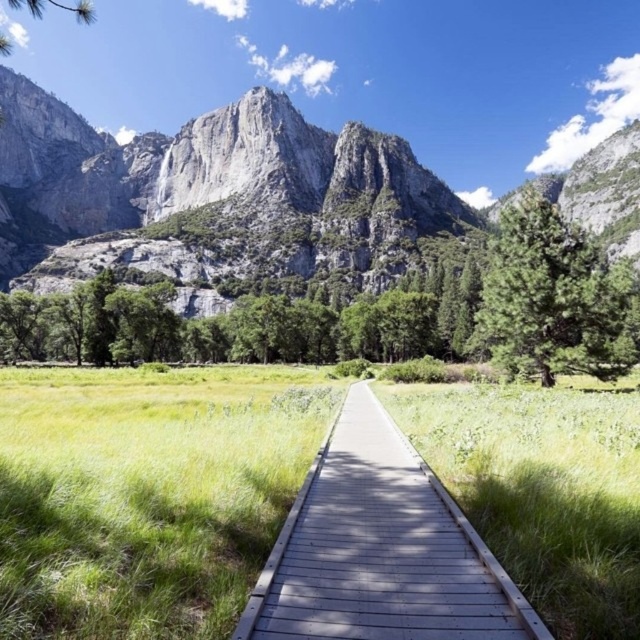
Is point (232, 262) positioned in front of point (246, 637)?

That is False.

Can you confirm if gray rock mountain at center is positioned to the left of wooden boardwalk at center?

Yes, gray rock mountain at center is to the left of wooden boardwalk at center.

Does point (6, 225) come in front of point (294, 518)?

No, it is not.

Locate an element on the screen. This screenshot has height=640, width=640. gray rock mountain at center is located at coordinates (216, 198).